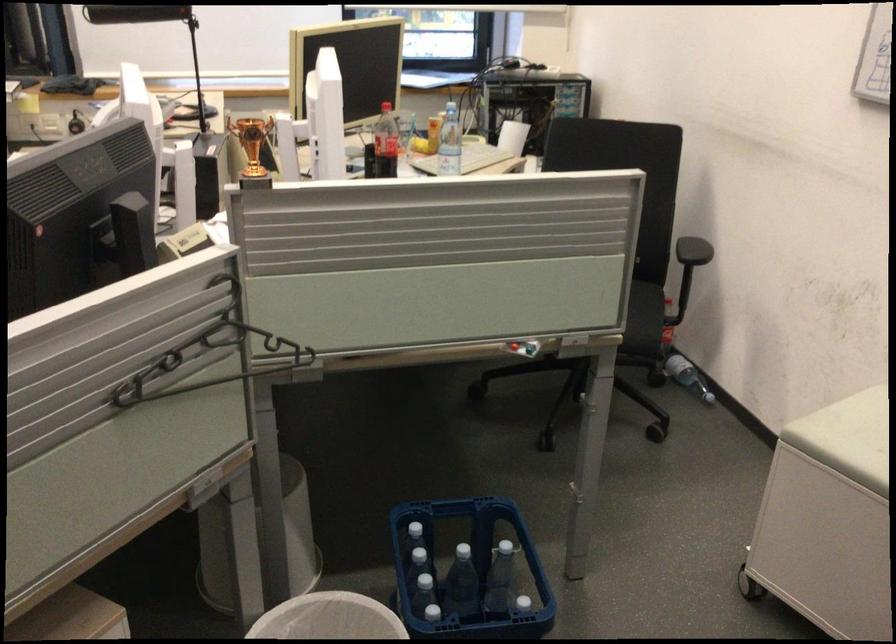
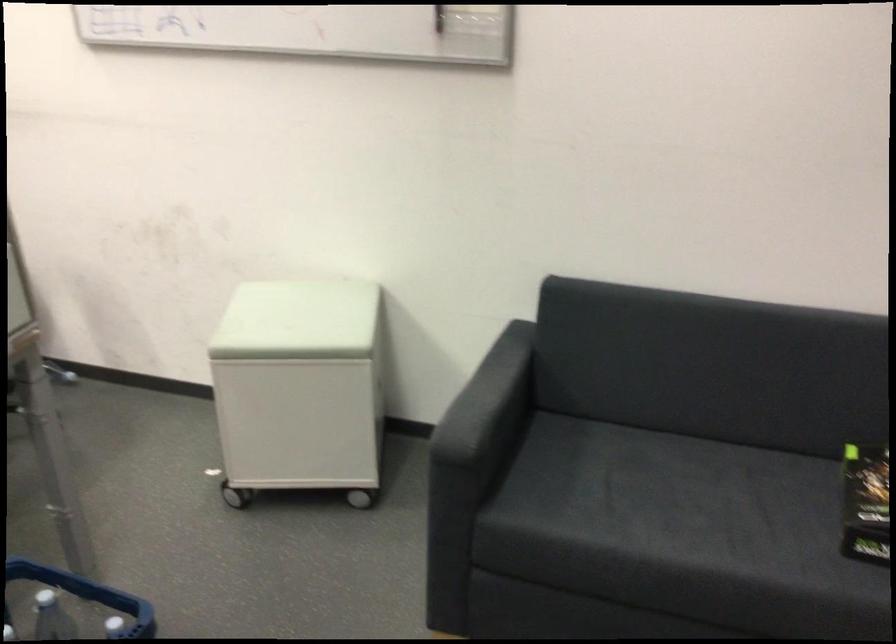
Question: The images are taken continuously from a first-person perspective. In which direction is your viewpoint rotating?

Choices:
 (A) Left
 (B) Right
 (C) Up
 (D) Down

Answer: (B)